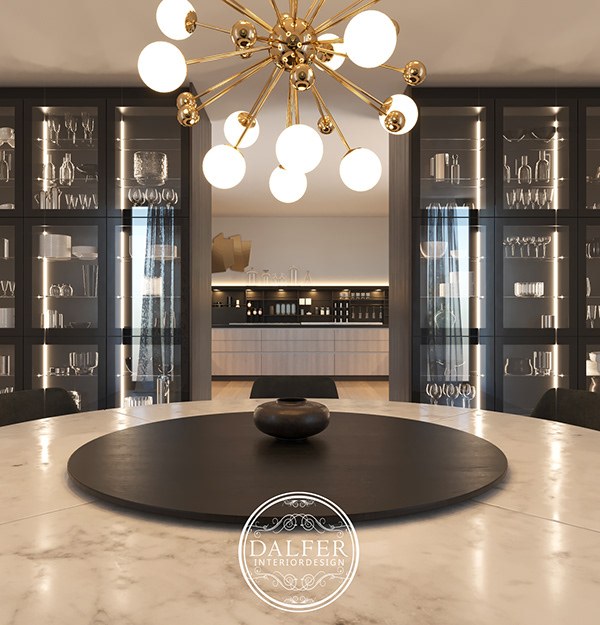
Image resolution: width=600 pixels, height=625 pixels. Find the location of `surface`. surface is located at coordinates (276, 378).